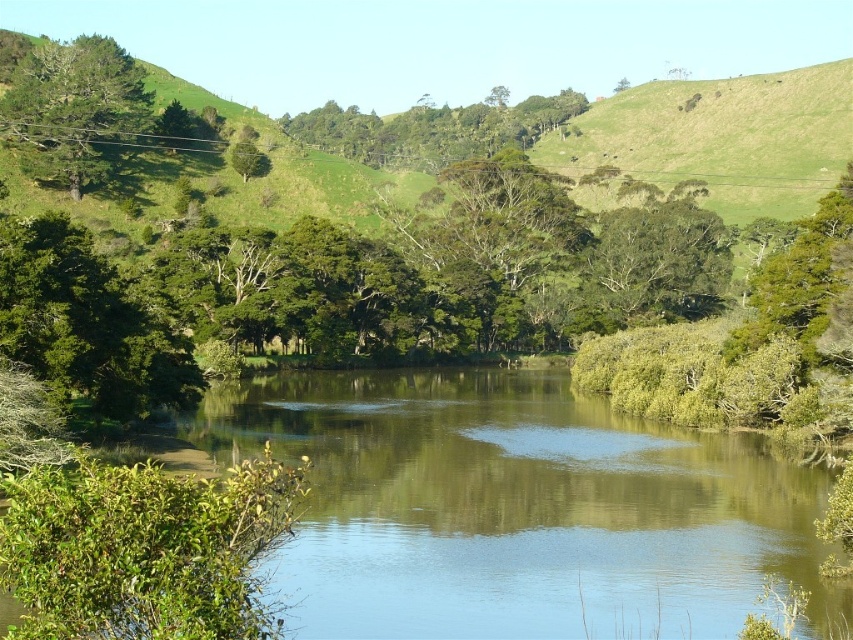
Question: Is green smooth water at center further to the viewer compared to green leafy tree at left?

Choices:
 (A) no
 (B) yes

Answer: (A)

Question: Based on their relative distances, which object is farther from the green leafy tree at left?

Choices:
 (A) green leafy tree at upper right
 (B) green leafy tree at upper center

Answer: (B)

Question: Which object is closer to the camera taking this photo?

Choices:
 (A) green leafy tree at upper left
 (B) green leafy tree at left

Answer: (B)

Question: Does green smooth water at center appear on the left side of green leafy tree at upper center?

Choices:
 (A) no
 (B) yes

Answer: (A)

Question: Does green leafy tree at left appear on the left side of green leafy tree at upper center?

Choices:
 (A) no
 (B) yes

Answer: (B)

Question: Which object is positioned farthest from the green leafy tree at upper center?

Choices:
 (A) green leafy tree at left
 (B) green smooth water at center
 (C) green leafy tree at upper left

Answer: (A)